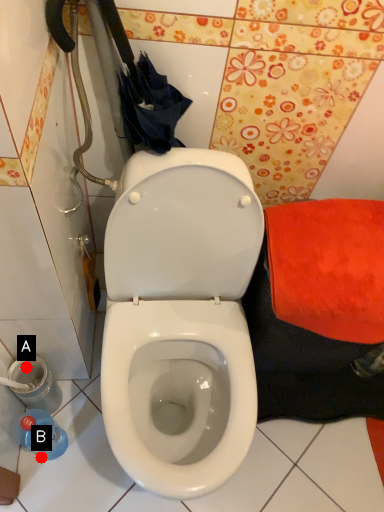
Question: Two points are circled on the image, labeled by A and B beside each circle. Which point appears closest to the camera in this image?

Choices:
 (A) A is closer
 (B) B is closer

Answer: (B)